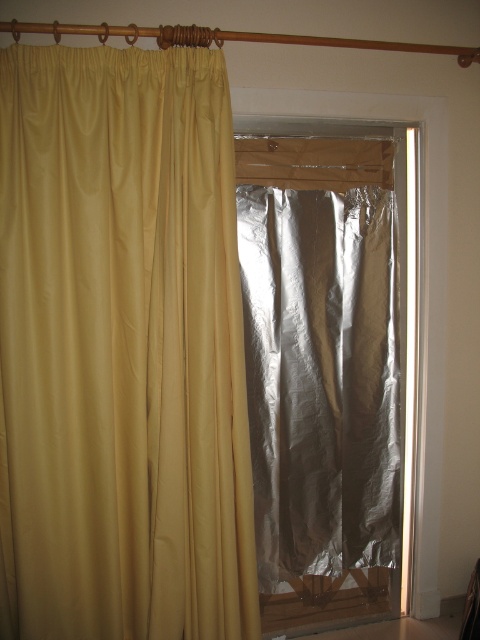
Question: Can you confirm if matte yellow curtain at left is thinner than shiny metallic screen door at center?

Choices:
 (A) no
 (B) yes

Answer: (A)

Question: Can you confirm if matte yellow curtain at left is positioned above shiny metallic screen door at center?

Choices:
 (A) yes
 (B) no

Answer: (A)

Question: Which object appears closest to the camera in this image?

Choices:
 (A) matte yellow curtain at left
 (B) shiny metallic screen door at center

Answer: (A)

Question: Does matte yellow curtain at left appear over shiny metallic screen door at center?

Choices:
 (A) yes
 (B) no

Answer: (A)

Question: Among these objects, which one is farthest from the camera?

Choices:
 (A) matte yellow curtain at left
 (B) shiny metallic screen door at center

Answer: (B)